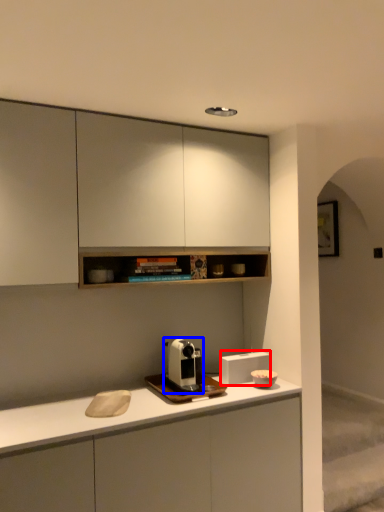
Question: Which of the following is the closest to the observer, appliance (highlighted by a red box) or coffee machine (highlighted by a blue box)?

Choices:
 (A) appliance
 (B) coffee machine

Answer: (B)